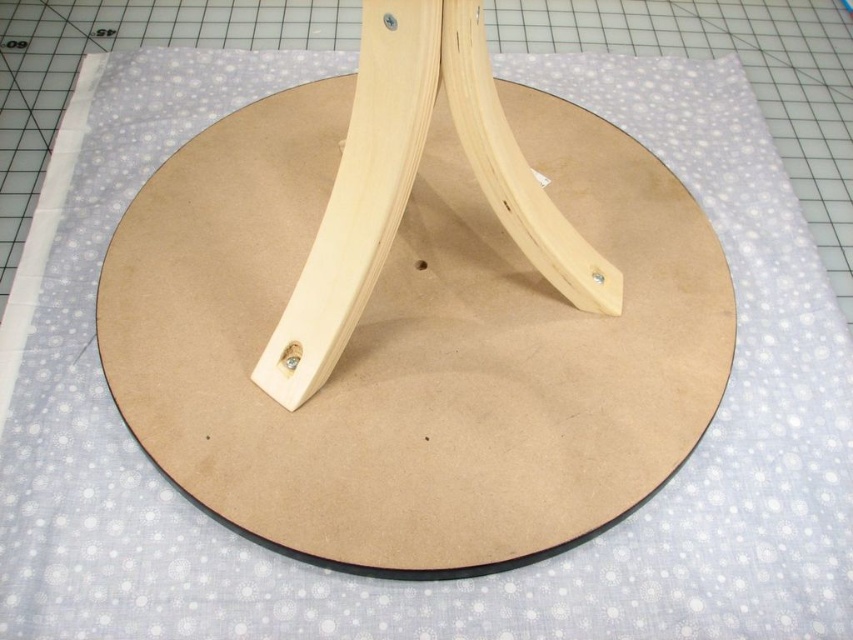
You are setting up a decorative centerpiece for a table. The natural wood round base at center needs to be placed on top of the natural wood tripod at center. Based on the image, will the round base fit securely on the tripod without wobbling?

The natural wood round base at center might be wider than natural wood tripod at center, so there is a possibility that the round base could wobble if the tripod is narrower than the base. Ensure the tripod can support the width of the base before placing it.

In the scene shown: You are setting up a small lamp on the natural wood round base at center. The lamp requires a stable support within 6 inches from the natural wood tripod at center. Will the current placement allow the lamp to be securely placed?

The distance between the natural wood round base at center and the natural wood tripod at center is 7.05 inches, which exceeds the required 6 inches for stability. Therefore, the lamp may not be securely placed in its current position.

In the scene shown: You are examining a wooden structure on a crafting table and notice two points labeled as point (292,90) and point (515,147). Which point is closer to the camera?

Point (292,90) is further to the camera than point (515,147), so the point closer to the camera is point (515,147).